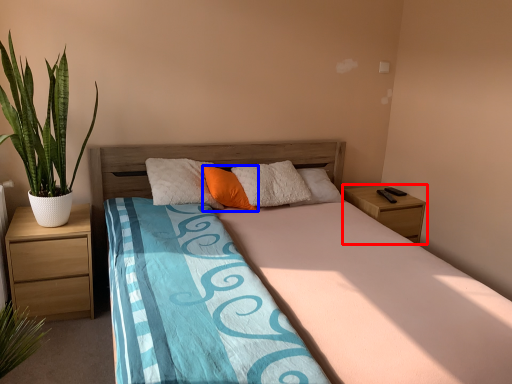
Question: Among these objects, which one is nearest to the camera, nightstand (highlighted by a red box) or pillow (highlighted by a blue box)?

Choices:
 (A) nightstand
 (B) pillow

Answer: (B)